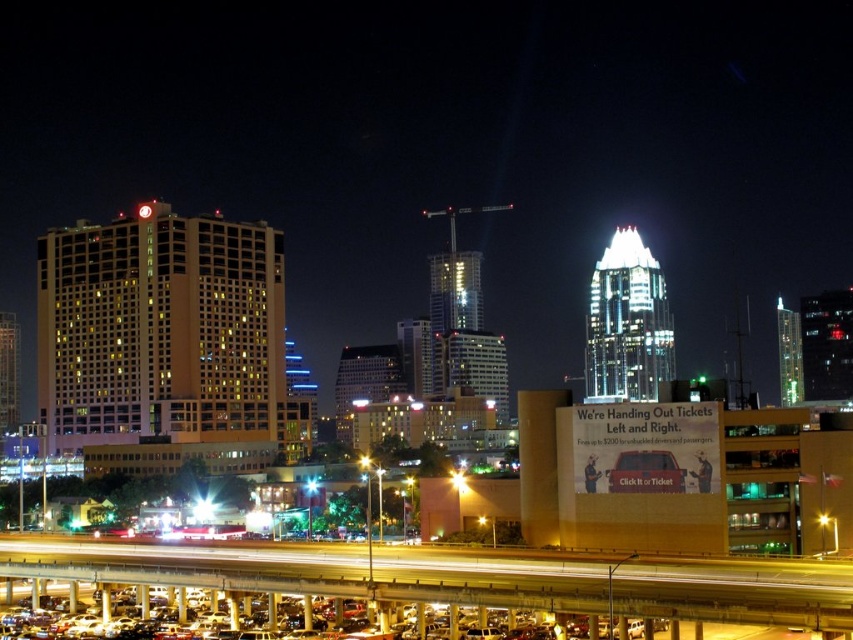
Is point (659, 604) positioned before point (537, 636)?

Yes.

Is point (381, 566) farther from camera compared to point (35, 612)?

No, it is not.

You are a GUI agent. You are given a task and a screenshot of the screen. Output one action in this format:
    pyautogui.click(x=<x>, y=<y>)
    Task: Click on the yellow concrete highway at lower center
    This screenshot has width=853, height=640.
    Given the screenshot: What is the action you would take?
    pyautogui.click(x=326, y=570)